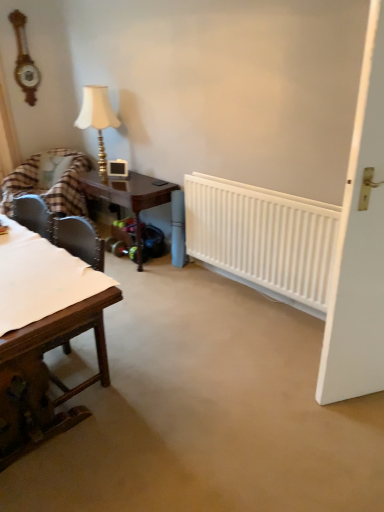
Identify the location of matte gold table lamp at upper left. (97, 119).

The width and height of the screenshot is (384, 512). What do you see at coordinates (45, 376) in the screenshot?
I see `wooden table at left, the 1th table from the front` at bounding box center [45, 376].

Locate an element on the screen. Image resolution: width=384 pixels, height=512 pixels. white plastic radiator at center is located at coordinates (262, 236).

Is the position of white plastic radiator at center more distant than that of wooden table at left, the 2th table when ordered from back to front?

That is True.

Would you say wooden table at left, the 2th table when ordered from back to front, is part of white plastic radiator at center's contents?

No, wooden table at left, the 2th table when ordered from back to front, is not a part of white plastic radiator at center.

Based on the photo, between white plastic radiator at center and wooden table at left, the 2th table when ordered from back to front, which one has larger width?

wooden table at left, the 2th table when ordered from back to front, is wider.

From the picture: Considering the sizes of white plastic radiator at center and wooden table at left, the 2th table when ordered from back to front, in the image, is white plastic radiator at center bigger or smaller than wooden table at left, the 2th table when ordered from back to front,?

Considering their sizes, white plastic radiator at center takes up less space than wooden table at left, the 2th table when ordered from back to front.

Is matte gold table lamp at upper left spatially inside white plastic radiator at center, or outside of it?

matte gold table lamp at upper left is not enclosed by white plastic radiator at center.

Is matte gold table lamp at upper left further to the viewer compared to white plastic radiator at center?

Yes, it is.

Which is closer to the camera, (88, 114) or (198, 234)?

Point (88, 114).

From a real-world perspective, between matte gold table lamp at upper left and white plastic radiator at center, who is vertically higher?

matte gold table lamp at upper left.

Which of these two, plaid fabric chair at left or white matte door at right, stands shorter?

plaid fabric chair at left is shorter.

In order to click on door positioned vertically above the plaid fabric chair at left (from a real-world perspective) in this screenshot , I will do `click(359, 246)`.

Measure the distance from plaid fabric chair at left to white matte door at right.

plaid fabric chair at left is 9.25 feet from white matte door at right.

From a real-world perspective, which is physically above, plaid fabric chair at left or white matte door at right?

white matte door at right is physically above.

How distant is white plastic radiator at center from plaid fabric chair at left?

They are 1.77 meters apart.

Consider the image. From a real-world perspective, is white plastic radiator at center located beneath plaid fabric chair at left?

No, from a real-world perspective, white plastic radiator at center is not under plaid fabric chair at left.

Which of these two, white plastic radiator at center or plaid fabric chair at left, stands taller?

With more height is plaid fabric chair at left.

Between point (333, 229) and point (74, 188), which one is positioned behind?

Positioned behind is point (74, 188).

Is white matte door at right inside the boundaries of plaid fabric chair at left, or outside?

white matte door at right is not enclosed by plaid fabric chair at left.

Does white matte door at right appear on the right side of plaid fabric chair at left?

Yes, white matte door at right is to the right of plaid fabric chair at left.

Which of these two, white matte door at right or plaid fabric chair at left, is bigger?

plaid fabric chair at left is bigger.

From the image's perspective, is wooden clock at upper left located above or below wooden table at left, the 2th table when ordered from back to front?

From the image's perspective, wooden clock at upper left appears above wooden table at left, the 2th table when ordered from back to front.

Is wooden table at left, the 1th table from the front, at the back of wooden clock at upper left?

No, wooden clock at upper left is not facing away from wooden table at left, the 1th table from the front.

Is wooden clock at upper left shorter than wooden table at left, the 2th table when ordered from back to front?

In fact, wooden clock at upper left may be taller than wooden table at left, the 2th table when ordered from back to front.

Which table is the 1st one when counting from the right side of the wooden clock at upper left? Please provide its 2D coordinates.

[(45, 376)]

Between matte gold table lamp at upper left and wooden clock at upper left, which one has larger size?

With larger size is matte gold table lamp at upper left.

Measure the distance between matte gold table lamp at upper left and wooden clock at upper left.

matte gold table lamp at upper left and wooden clock at upper left are 36.19 inches apart from each other.

Can you see matte gold table lamp at upper left touching wooden clock at upper left?

No.

Could you tell me if matte gold table lamp at upper left is turned towards wooden clock at upper left?

No, matte gold table lamp at upper left does not turn towards wooden clock at upper left.

What are the coordinates of `radiator lying above the wooden table at left, the 2th table when ordered from back to front (from the image's perspective)` in the screenshot? It's located at (262, 236).

Find the location of a particular element. table lamp that appears on the left of white plastic radiator at center is located at coordinates (97, 119).

Considering their positions, is white plastic radiator at center positioned further to mahogany wood table at center, acting as the second table starting from the front, than white matte door at right?

Based on the image, white matte door at right appears to be further to mahogany wood table at center, acting as the second table starting from the front.

Considering their positions, is matte gold table lamp at upper left positioned closer to wooden clock at upper left than white matte door at right?

matte gold table lamp at upper left lies closer to wooden clock at upper left than the other object.

When comparing their distances from wooden clock at upper left, does white matte door at right or white plastic radiator at center seem further?

white matte door at right is positioned further to the anchor wooden clock at upper left.

From the image, which object appears to be nearer to wooden clock at upper left, matte gold table lamp at upper left or mahogany wood table at center, acting as the second table starting from the front?

Based on the image, matte gold table lamp at upper left appears to be nearer to wooden clock at upper left.

Based on their spatial positions, is mahogany wood table at center, the first table viewed from the back, or wooden clock at upper left further from matte gold table lamp at upper left?

Among the two, wooden clock at upper left is located further to matte gold table lamp at upper left.

Estimate the real-world distances between objects in this image. Which object is further from plaid fabric chair at left, white plastic radiator at center or wooden clock at upper left?

white plastic radiator at center.

Considering their positions, is white matte door at right positioned further to wooden table at left, the 1th table from the front, than white plastic radiator at center?

Based on the image, white plastic radiator at center appears to be further to wooden table at left, the 1th table from the front.

From the image, which object appears to be farther from wooden clock at upper left, wooden table at left, the 1th table from the front, or matte gold table lamp at upper left?

wooden table at left, the 1th table from the front, lies further to wooden clock at upper left than the other object.

Where is `radiator positioned between wooden table at left, the 2th table when ordered from back to front, and plaid fabric chair at left from near to far`? radiator positioned between wooden table at left, the 2th table when ordered from back to front, and plaid fabric chair at left from near to far is located at coordinates (262, 236).

This screenshot has height=512, width=384. In order to click on radiator between white matte door at right and matte gold table lamp at upper left along the z-axis in this screenshot , I will do `click(262, 236)`.

Find the location of a particular element. The width and height of the screenshot is (384, 512). table lamp between wooden clock at upper left and plaid fabric chair at left from top to bottom is located at coordinates (97, 119).

Where is `chair located between wooden clock at upper left and white matte door at right in the left-right direction`? The height and width of the screenshot is (512, 384). chair located between wooden clock at upper left and white matte door at right in the left-right direction is located at coordinates (68, 185).